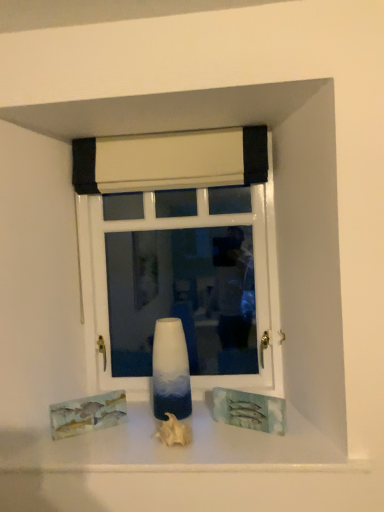
Consider the image. Measure the distance between point (118, 412) and camera.

Point (118, 412) and camera are 5.50 feet apart.

What do you see at coordinates (87, 414) in the screenshot?
I see `watercolor paper painting at lower left, marked as the 2th art in a right-to-left arrangement` at bounding box center [87, 414].

This screenshot has width=384, height=512. What do you see at coordinates (180, 256) in the screenshot?
I see `white glossy window at center` at bounding box center [180, 256].

You are a GUI agent. You are given a task and a screenshot of the screen. Output one action in this format:
    pyautogui.click(x=<x>, y=<y>)
    Task: Click on the white glossy vase at center
    Image resolution: width=384 pixels, height=512 pixels.
    Given the screenshot: What is the action you would take?
    pyautogui.click(x=170, y=370)

Describe the element at coordinates (170, 370) in the screenshot. The image size is (384, 512). I see `white glossy vase at center` at that location.

At what (x,y) coordinates should I click in order to perform the action: click on white matte seashell at center, placed as the second art when sorted from left to right. Please return your answer as a coordinate pair (x, y). The height and width of the screenshot is (512, 384). Looking at the image, I should click on (174, 431).

I want to click on white fabric curtain at upper center, so pyautogui.click(x=170, y=161).

Where is `watercolor paper painting at lower left, marked as the 2th art in a right-to-left arrangement`? watercolor paper painting at lower left, marked as the 2th art in a right-to-left arrangement is located at coordinates (87, 414).

Who is bigger, white matte seashell at center, placed as the second art when sorted from left to right, or watercolor paper painting at lower left, marked as the 2th art in a right-to-left arrangement?

white matte seashell at center, placed as the second art when sorted from left to right, is bigger.

From a real-world perspective, is white matte seashell at center, the first art viewed from the right, on watercolor paper painting at lower left, arranged as the first art when viewed from the left?

No, from a real-world perspective, white matte seashell at center, the first art viewed from the right, is not on top of watercolor paper painting at lower left, arranged as the first art when viewed from the left.

In the scene shown: Is white matte seashell at center, placed as the second art when sorted from left to right, thinner than watercolor paper painting at lower left, marked as the 2th art in a right-to-left arrangement?

Incorrect, the width of white matte seashell at center, placed as the second art when sorted from left to right, is not less than that of watercolor paper painting at lower left, marked as the 2th art in a right-to-left arrangement.

Is point (168, 442) more distant than point (102, 408)?

No.

Which is behind, white glossy window at center or watercolor paper painting at lower left, arranged as the first art when viewed from the left?

white glossy window at center is further from the camera.

From the image's perspective, which is below, white glossy window at center or watercolor paper painting at lower left, arranged as the first art when viewed from the left?

watercolor paper painting at lower left, arranged as the first art when viewed from the left.

Based on their sizes in the image, would you say white glossy window at center is bigger or smaller than watercolor paper painting at lower left, arranged as the first art when viewed from the left?

Clearly, white glossy window at center is larger in size than watercolor paper painting at lower left, arranged as the first art when viewed from the left.

Is white glossy window at center touching white matte seashell at center, placed as the second art when sorted from left to right?

white glossy window at center and white matte seashell at center, placed as the second art when sorted from left to right, are not in contact.

Could you measure the distance between white glossy window at center and white matte seashell at center, the first art viewed from the right?

white glossy window at center is 24.99 inches from white matte seashell at center, the first art viewed from the right.

Between white glossy window at center and white matte seashell at center, the first art viewed from the right, which one has smaller size?

white matte seashell at center, the first art viewed from the right.

Looking at this image, looking at the image, does white fabric curtain at upper center seem bigger or smaller compared to white glossy window at center?

white fabric curtain at upper center is smaller than white glossy window at center.

Between white fabric curtain at upper center and white glossy window at center, which one appears on the right side from the viewer's perspective?

From the viewer's perspective, white glossy window at center appears more on the right side.

Which is nearer, (85, 170) or (231, 248)?

The point (85, 170) is closer to the camera.

Measure the distance between white fabric curtain at upper center and white glossy window at center.

6.13 inches.

How distant is white glossy window at center from white glossy vase at center?

31.36 centimeters.

From the image's perspective, which is above, white glossy window at center or white glossy vase at center?

From the image's view, white glossy window at center is above.

Between white glossy window at center and white glossy vase at center, which one has smaller width?

white glossy window at center.

Can you tell me how much white glossy window at center and white glossy vase at center differ in facing direction?

The angular difference between white glossy window at center and white glossy vase at center is 2.86 degrees.

Choose the correct answer: Is white glossy vase at center inside white glossy window at center or outside it?

white glossy vase at center is not enclosed by white glossy window at center.

From the image's perspective, between white glossy vase at center and white glossy window at center, which one is located above?

white glossy window at center appears higher in the image.

Is point (161, 332) closer or farther from the camera than point (107, 244)?

Point (161, 332) appears to be closer to the viewer than point (107, 244).

Is white fabric curtain at upper center far away from white glossy vase at center?

white fabric curtain at upper center is actually quite close to white glossy vase at center.

How different are the orientations of white fabric curtain at upper center and white glossy vase at center in degrees?

3.18 degrees.

Does white fabric curtain at upper center come behind white glossy vase at center?

Yes, white fabric curtain at upper center is behind white glossy vase at center.

Identify the location of art below the white matte seashell at center, the first art viewed from the right (from the image's perspective). The width and height of the screenshot is (384, 512). (87, 414).

Locate an element on the screen. art that is the 2nd object to the left of the white glossy window at center, starting at the anchor is located at coordinates (87, 414).

Considering their positions, is white glossy window at center positioned closer to watercolor paper painting at lower left, arranged as the first art when viewed from the left, than white glossy vase at center?

The object closer to watercolor paper painting at lower left, arranged as the first art when viewed from the left, is white glossy vase at center.

When comparing their distances from white glossy window at center, does watercolor paper painting at lower left, marked as the 2th art in a right-to-left arrangement, or white matte seashell at center, placed as the second art when sorted from left to right, seem further?

white matte seashell at center, placed as the second art when sorted from left to right, lies further to white glossy window at center than the other object.

Considering their positions, is watercolor paper painting at lower left, arranged as the first art when viewed from the left, positioned further to white matte seashell at center, placed as the second art when sorted from left to right, than white fabric curtain at upper center?

white fabric curtain at upper center lies further to white matte seashell at center, placed as the second art when sorted from left to right, than the other object.

When comparing their distances from white matte seashell at center, placed as the second art when sorted from left to right, does white fabric curtain at upper center or white glossy window at center seem further?

white fabric curtain at upper center is further to white matte seashell at center, placed as the second art when sorted from left to right.

From the image, which object appears to be farther from white glossy window at center, white matte seashell at center, the first art viewed from the right, or watercolor paper painting at lower left, marked as the 2th art in a right-to-left arrangement?

white matte seashell at center, the first art viewed from the right.

From the image, which object appears to be farther from white glossy vase at center, white matte seashell at center, placed as the second art when sorted from left to right, or white fabric curtain at upper center?

white fabric curtain at upper center is positioned further to the anchor white glossy vase at center.

Based on their spatial positions, is white matte seashell at center, the first art viewed from the right, or white glossy window at center closer to white glossy vase at center?

white matte seashell at center, the first art viewed from the right, is positioned closer to the anchor white glossy vase at center.

When comparing their distances from watercolor paper painting at lower left, marked as the 2th art in a right-to-left arrangement, does white glossy vase at center or white matte seashell at center, placed as the second art when sorted from left to right, seem closer?

Among the two, white glossy vase at center is located nearer to watercolor paper painting at lower left, marked as the 2th art in a right-to-left arrangement.

This screenshot has height=512, width=384. I want to click on vase between watercolor paper painting at lower left, marked as the 2th art in a right-to-left arrangement, and white matte seashell at center, placed as the second art when sorted from left to right, in the horizontal direction, so click(x=170, y=370).

The width and height of the screenshot is (384, 512). In order to click on window between white fabric curtain at upper center and white glossy vase at center in the vertical direction in this screenshot , I will do `click(180, 256)`.

At what (x,y) coordinates should I click in order to perform the action: click on vase between white glossy window at center and watercolor paper painting at lower left, marked as the 2th art in a right-to-left arrangement, vertically. Please return your answer as a coordinate pair (x, y). This screenshot has width=384, height=512. Looking at the image, I should click on (170, 370).

You are a GUI agent. You are given a task and a screenshot of the screen. Output one action in this format:
    pyautogui.click(x=<x>, y=<y>)
    Task: Click on the window that lies between white fabric curtain at upper center and watercolor paper painting at lower left, arranged as the first art when viewed from the left, from top to bottom
    
    Given the screenshot: What is the action you would take?
    pyautogui.click(x=180, y=256)